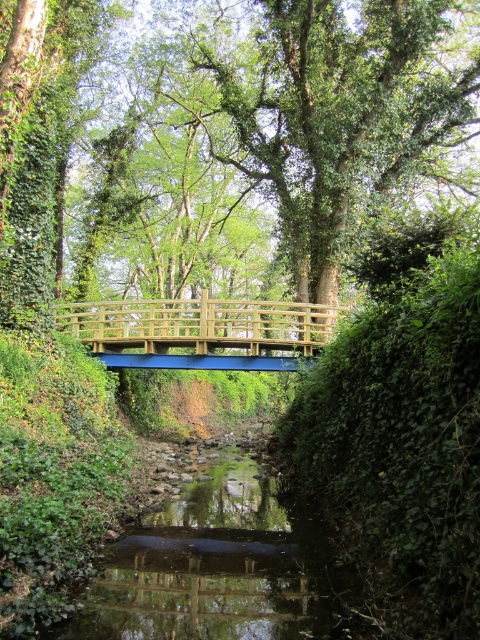
Can you confirm if green leafy tree at center is positioned above wooden bridge at center?

Correct, green leafy tree at center is located above wooden bridge at center.

Between point (416, 118) and point (266, 307), which one is positioned in front?

Point (266, 307)

Is point (11, 128) closer to viewer compared to point (265, 355)?

Yes, point (11, 128) is closer to viewer.

At what (x,y) coordinates should I click in order to perform the action: click on green leafy tree at center. Please return your answer as a coordinate pair (x, y). Looking at the image, I should click on (222, 156).